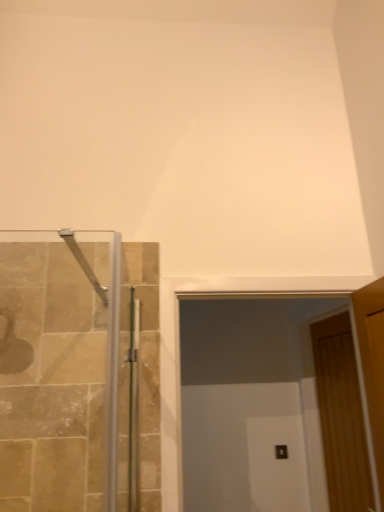
Measure the distance between transparent glass door at center and camera.

7.02 feet.

Locate an element on the screen. transparent glass door at center is located at coordinates (266, 404).

This screenshot has height=512, width=384. Describe the element at coordinates (266, 404) in the screenshot. I see `transparent glass door at center` at that location.

What do you see at coordinates (341, 416) in the screenshot? The image size is (384, 512). I see `wooden door at right` at bounding box center [341, 416].

You are a GUI agent. You are given a task and a screenshot of the screen. Output one action in this format:
    pyautogui.click(x=<x>, y=<y>)
    Task: Click on the wooden door at right
    
    Given the screenshot: What is the action you would take?
    pyautogui.click(x=341, y=416)

At what (x,y) coordinates should I click in order to perform the action: click on transparent glass door at center. Please return your answer as a coordinate pair (x, y). Looking at the image, I should click on (266, 404).

Considering the positions of objects wooden door at right and transparent glass door at center in the image provided, who is more to the left, wooden door at right or transparent glass door at center?

From the viewer's perspective, transparent glass door at center appears more on the left side.

Relative to transparent glass door at center, is wooden door at right in front or behind?

Clearly, wooden door at right is behind transparent glass door at center.

Does point (348, 490) appear closer or farther from the camera than point (276, 351)?

Point (348, 490).

From the image's perspective, is wooden door at right under transparent glass door at center?

Indeed, from the image's perspective, wooden door at right is shown beneath transparent glass door at center.

In the scene shown: From a real-world perspective, is wooden door at right positioned over transparent glass door at center based on gravity?

No, from a real-world perspective, wooden door at right is not on top of transparent glass door at center.

Is wooden door at right wider or thinner than transparent glass door at center?

In the image, wooden door at right appears to be more narrow than transparent glass door at center.

From the picture: Is wooden door at right taller or shorter than transparent glass door at center?

Clearly, wooden door at right is taller compared to transparent glass door at center.

Based on their sizes in the image, would you say wooden door at right is bigger or smaller than transparent glass door at center?

In the image, wooden door at right appears to be smaller than transparent glass door at center.

Is wooden door at right positioned beyond the bounds of transparent glass door at center?

Yes, wooden door at right is not within transparent glass door at center.

Are wooden door at right and transparent glass door at center located far from each other?

Actually, wooden door at right and transparent glass door at center are a little close together.

Is wooden door at right aimed at transparent glass door at center?

No.

Can you tell me how much wooden door at right and transparent glass door at center differ in facing direction?

They differ by 88.7 degrees in their facing directions.

At what (x,y) coordinates should I click in order to perform the action: click on glass door located in front of the wooden door at right. Please return your answer as a coordinate pair (x, y). This screenshot has width=384, height=512. Looking at the image, I should click on (266, 404).

Between transparent glass door at center and wooden door at right, which one appears on the right side from the viewer's perspective?

Positioned to the right is wooden door at right.

Considering their positions, is transparent glass door at center located in front of or behind wooden door at right?

In the image, transparent glass door at center appears in front of wooden door at right.

Looking at this image, which is closer to the camera, (221, 486) or (367, 455)?

The point (367, 455) is closer.

Looking at this image, from the image's perspective, is transparent glass door at center above or below wooden door at right?

Based on their image positions, transparent glass door at center is located above wooden door at right.

Consider the image. From a real-world perspective, is transparent glass door at center physically above wooden door at right?

Indeed, from a real-world perspective, transparent glass door at center stands above wooden door at right.

Which object is wider, transparent glass door at center or wooden door at right?

transparent glass door at center is wider.

Is transparent glass door at center taller than wooden door at right?

No, transparent glass door at center is not taller than wooden door at right.

Considering the relative sizes of transparent glass door at center and wooden door at right in the image provided, is transparent glass door at center smaller than wooden door at right?

No, transparent glass door at center is not smaller than wooden door at right.

Would you say wooden door at right is part of transparent glass door at center's contents?

No, wooden door at right is not a part of transparent glass door at center.

Is transparent glass door at center not close to wooden door at right?

They are positioned close to each other.

Is wooden door at right at the back of transparent glass door at center?

Absolutely, transparent glass door at center is directed away from wooden door at right.

You are a GUI agent. You are given a task and a screenshot of the screen. Output one action in this format:
    pyautogui.click(x=<x>, y=<y>)
    Task: Click on the door behind the transparent glass door at center
    The width and height of the screenshot is (384, 512).
    Given the screenshot: What is the action you would take?
    (341, 416)

This screenshot has height=512, width=384. What are the coordinates of `door that appears behind the transparent glass door at center` in the screenshot? It's located at (341, 416).

Locate an element on the screen. This screenshot has width=384, height=512. glass door above the wooden door at right (from a real-world perspective) is located at coordinates (266, 404).